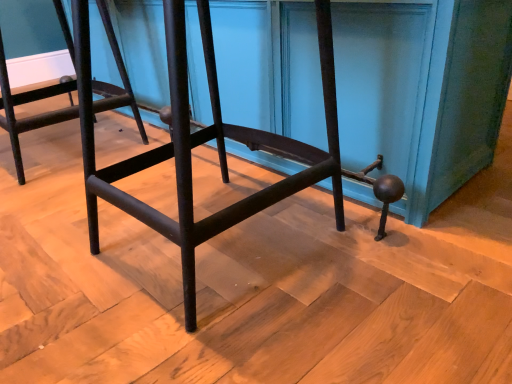
You are a GUI agent. You are given a task and a screenshot of the screen. Output one action in this format:
    pyautogui.click(x=<x>, y=<y>)
    Task: Click on the vacant space to the right of matte black stool at center
    
    Given the screenshot: What is the action you would take?
    pyautogui.click(x=411, y=251)